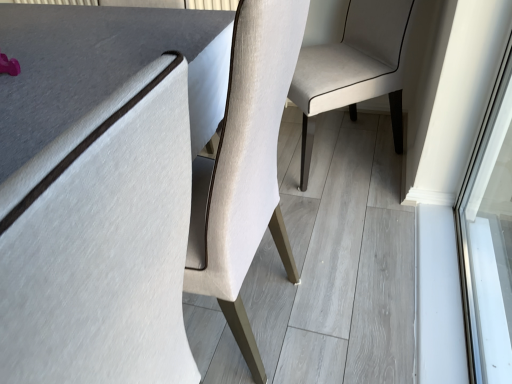
This screenshot has width=512, height=384. Identify the location of vacant location below light beige fabric chair at center (from a real-world perspective). (333, 162).